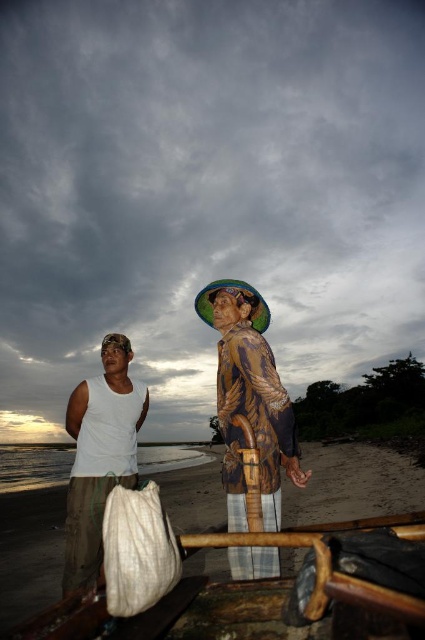
Is wooden statue at center positioned at the back of white matte tank top at center?

No.

Describe the element at coordinates (249, 397) in the screenshot. I see `wooden statue at center` at that location.

Describe the element at coordinates (249, 397) in the screenshot. The height and width of the screenshot is (640, 425). I see `wooden statue at center` at that location.

Where is `wooden statue at center`? wooden statue at center is located at coordinates (249, 397).

Between point (17, 515) and point (238, 474), which one is positioned behind?

Point (17, 515)

Can you confirm if brown sand at lower center is positioned below wooden statue at center?

Yes, brown sand at lower center is below wooden statue at center.

Describe the element at coordinates (356, 483) in the screenshot. I see `brown sand at lower center` at that location.

Locate an element on the screen. Image resolution: width=425 pixels, height=640 pixels. brown sand at lower center is located at coordinates (356, 483).

In the scene shown: Does brown sand at lower center have a greater height compared to white fabric sack at lower left?

Yes, brown sand at lower center is taller than white fabric sack at lower left.

Which of these two, brown sand at lower center or white fabric sack at lower left, stands shorter?

Standing shorter between the two is white fabric sack at lower left.

Does point (286, 499) come closer to viewer compared to point (133, 560)?

That is False.

This screenshot has width=425, height=640. Find the location of `brown sand at lower center`. brown sand at lower center is located at coordinates (356, 483).